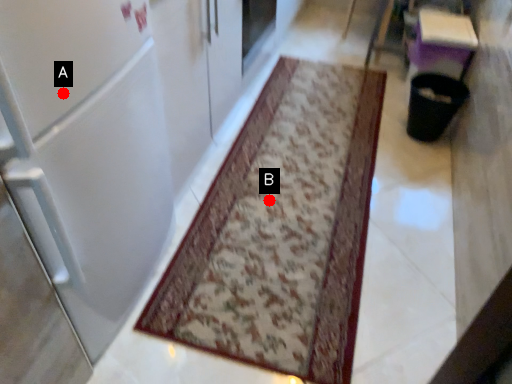
Question: Two points are circled on the image, labeled by A and B beside each circle. Which point is closer to the camera?

Choices:
 (A) A is closer
 (B) B is closer

Answer: (A)